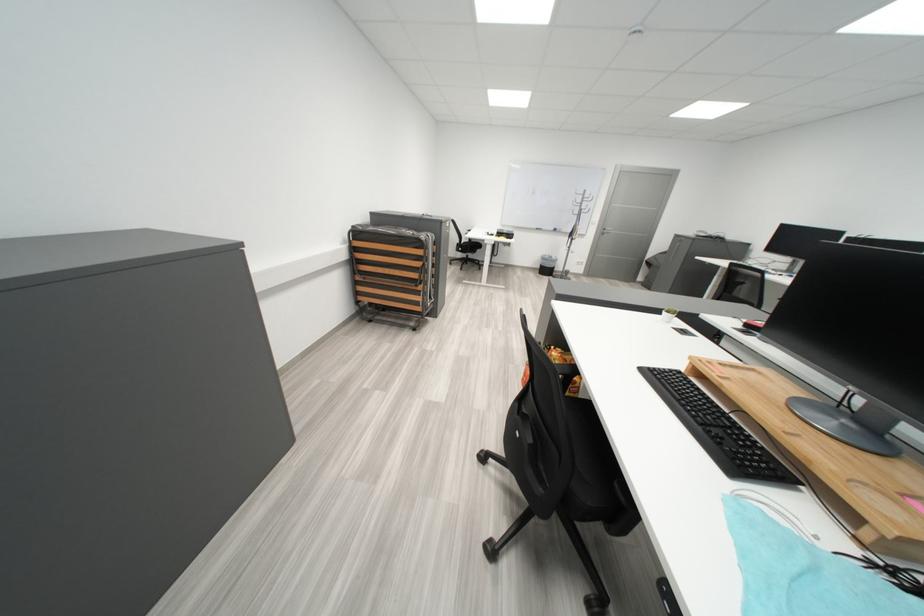
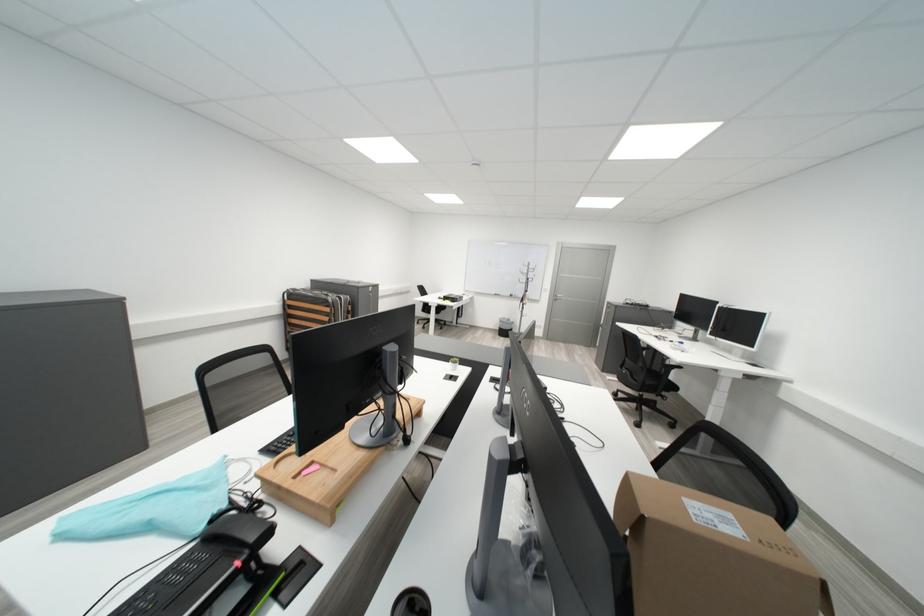
Question: The images are taken continuously from a first-person perspective. In which direction are you moving?

Choices:
 (A) Left
 (B) Right
 (C) Forward
 (D) Backward

Answer: (B)